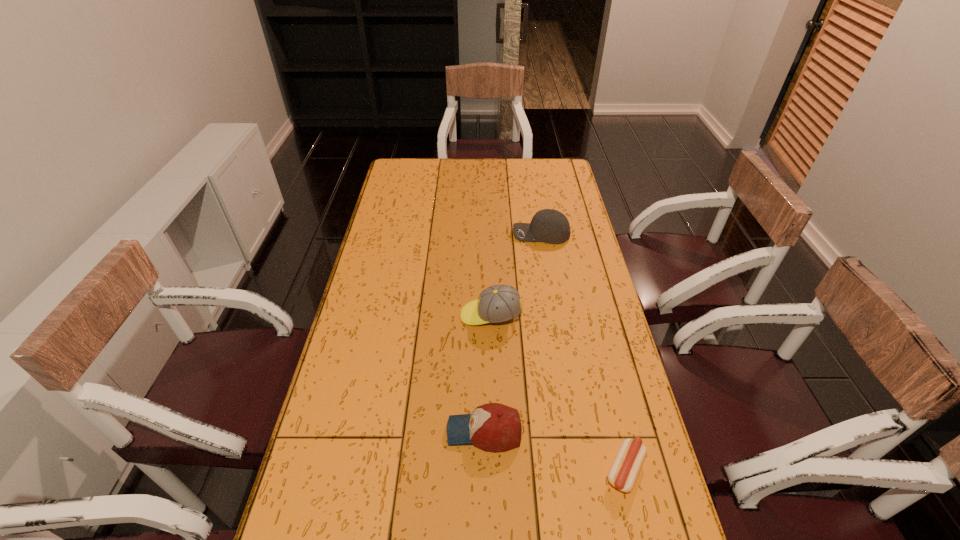
You are a GUI agent. You are given a task and a screenshot of the screen. Output one action in this format:
    pyautogui.click(x=<x>, y=<y>)
    Task: Click on the vacant space situated on the front brim of the farthest object
    The height and width of the screenshot is (540, 960).
    Given the screenshot: What is the action you would take?
    pos(430,234)

In order to click on free region located 0.270m on the front-facing side of the shortest baseball cap in this screenshot , I will do `click(343, 431)`.

Where is `free space located 0.320m on the front-facing side of the shortest baseball cap`? free space located 0.320m on the front-facing side of the shortest baseball cap is located at coordinates (x=324, y=431).

Locate an element on the screen. free space located 0.160m on the front-facing side of the shortest baseball cap is located at coordinates (385, 431).

Where is `free space located 0.310m on the back of the shortest object`? The width and height of the screenshot is (960, 540). free space located 0.310m on the back of the shortest object is located at coordinates (595, 347).

The width and height of the screenshot is (960, 540). I want to click on baseball cap that is at the right edge, so click(551, 226).

At what (x,y) coordinates should I click in order to perform the action: click on sausage that is positioned at the right edge. Please return your answer as a coordinate pair (x, y). Looking at the image, I should click on (627, 465).

Locate an element on the screen. The height and width of the screenshot is (540, 960). vacant space at the far edge of the desktop is located at coordinates (506, 170).

Where is `vacant space at the left edge of the desktop`? vacant space at the left edge of the desktop is located at coordinates (372, 284).

The height and width of the screenshot is (540, 960). In order to click on free space at the right edge of the desktop in this screenshot , I will do `click(576, 249)`.